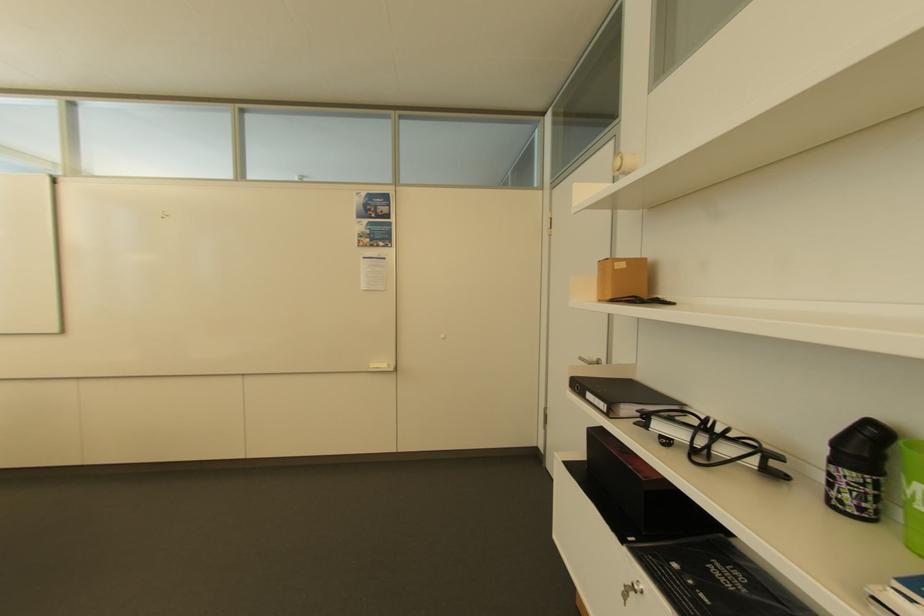
Where would you push the hole puncher handle? Please return your answer as a coordinate pair (x, y).

(710, 440)